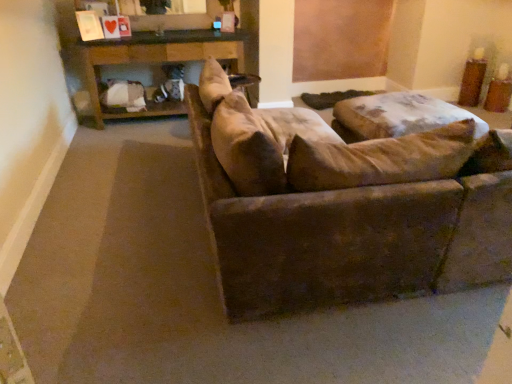
What do you see at coordinates (156, 61) in the screenshot? I see `wooden table at upper center` at bounding box center [156, 61].

Locate an element on the screen. wooden table at upper center is located at coordinates (156, 61).

The width and height of the screenshot is (512, 384). I want to click on suede brown couch at center, so click(344, 206).

What do you see at coordinates (344, 206) in the screenshot? The height and width of the screenshot is (384, 512). I see `suede brown couch at center` at bounding box center [344, 206].

I want to click on wooden table at upper center, so click(x=156, y=61).

Between wooden table at upper center and suede brown couch at center, which one appears on the right side from the viewer's perspective?

From the viewer's perspective, suede brown couch at center appears more on the right side.

Considering their positions, is wooden table at upper center located in front of or behind suede brown couch at center?

In the image, wooden table at upper center appears behind suede brown couch at center.

Between point (176, 51) and point (223, 83), which one is positioned in front?

The point (223, 83) is closer.

Consider the image. From the image's perspective, who appears lower, wooden table at upper center or suede brown couch at center?

suede brown couch at center, from the image's perspective.

From a real-world perspective, is wooden table at upper center on top of suede brown couch at center?

No, from a real-world perspective, wooden table at upper center is not over suede brown couch at center

In terms of width, does wooden table at upper center look wider or thinner when compared to suede brown couch at center?

In the image, wooden table at upper center appears to be more narrow than suede brown couch at center.

Considering the relative sizes of wooden table at upper center and suede brown couch at center in the image provided, is wooden table at upper center shorter than suede brown couch at center?

Indeed, wooden table at upper center has a lesser height compared to suede brown couch at center.

Considering the relative sizes of wooden table at upper center and suede brown couch at center in the image provided, is wooden table at upper center bigger than suede brown couch at center?

Incorrect, wooden table at upper center is not larger than suede brown couch at center.

Is wooden table at upper center inside or outside of suede brown couch at center?

wooden table at upper center is not enclosed by suede brown couch at center.

Are wooden table at upper center and suede brown couch at center far apart?

wooden table at upper center is far away from suede brown couch at center.

Is wooden table at upper center oriented away from suede brown couch at center?

wooden table at upper center does not have its back to suede brown couch at center.

The height and width of the screenshot is (384, 512). I want to click on table lying behind the suede brown couch at center, so click(156, 61).

Which is more to the left, suede brown couch at center or wooden table at upper center?

wooden table at upper center.

Which object is more forward, suede brown couch at center or wooden table at upper center?

suede brown couch at center is in front.

Is point (410, 184) positioned behind point (164, 50)?

That is False.

From the image's perspective, which is below, suede brown couch at center or wooden table at upper center?

suede brown couch at center is shown below in the image.

From a real-world perspective, who is located higher, suede brown couch at center or wooden table at upper center?

In real-world perspective, suede brown couch at center is above.

Does suede brown couch at center have a lesser width compared to wooden table at upper center?

No.

Considering the sizes of objects suede brown couch at center and wooden table at upper center in the image provided, who is shorter, suede brown couch at center or wooden table at upper center?

Standing shorter between the two is wooden table at upper center.

Who is bigger, suede brown couch at center or wooden table at upper center?

Bigger between the two is suede brown couch at center.

Is suede brown couch at center situated inside wooden table at upper center or outside?

suede brown couch at center is spatially situated outside wooden table at upper center.

Would you say suede brown couch at center is a long distance from wooden table at upper center?

That's right, there is a large distance between suede brown couch at center and wooden table at upper center.

Is suede brown couch at center positioned with its back to wooden table at upper center?

No, wooden table at upper center is not at the back of suede brown couch at center.

Can you tell me how much suede brown couch at center and wooden table at upper center differ in facing direction?

The facing directions of suede brown couch at center and wooden table at upper center are 179 degrees apart.

Image resolution: width=512 pixels, height=384 pixels. Find the location of `table located behind the suede brown couch at center`. table located behind the suede brown couch at center is located at coordinates (156, 61).

You are a GUI agent. You are given a task and a screenshot of the screen. Output one action in this format:
    pyautogui.click(x=<x>, y=<y>)
    Task: Click on the table above the suede brown couch at center (from the image's perspective)
    The image size is (512, 384).
    Given the screenshot: What is the action you would take?
    pyautogui.click(x=156, y=61)

What are the coordinates of `table behind the suede brown couch at center` in the screenshot? It's located at (156, 61).